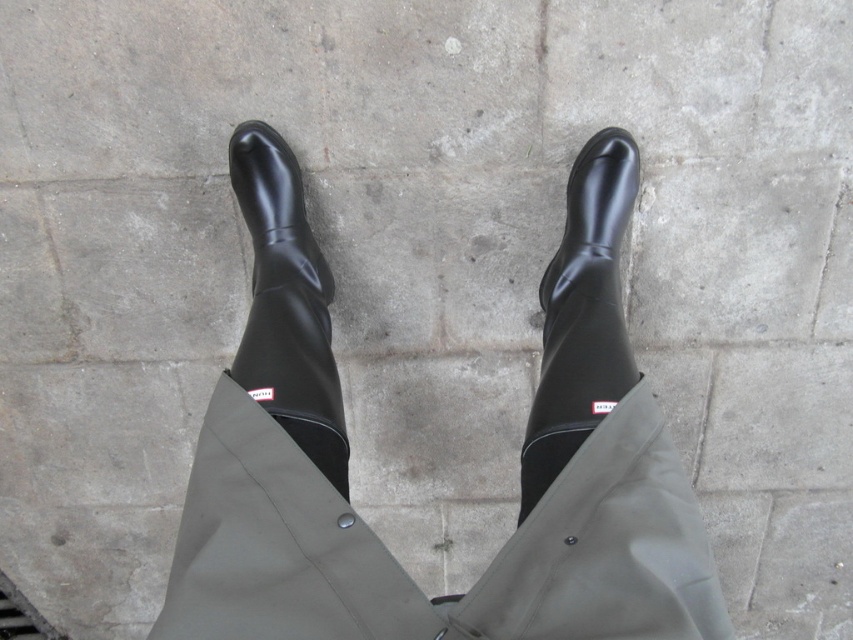
Question: Is black rubber boot at center to the right of shiny black boot at center from the viewer's perspective?

Choices:
 (A) yes
 (B) no

Answer: (A)

Question: Among these objects, which one is farthest from the camera?

Choices:
 (A) shiny black boot at center
 (B) black rubber boot at center

Answer: (B)

Question: Considering the relative positions of black rubber boot at center and shiny black boot at center in the image provided, where is black rubber boot at center located with respect to shiny black boot at center?

Choices:
 (A) left
 (B) right

Answer: (B)

Question: Can you confirm if black rubber boot at center is smaller than shiny black boot at center?

Choices:
 (A) no
 (B) yes

Answer: (B)